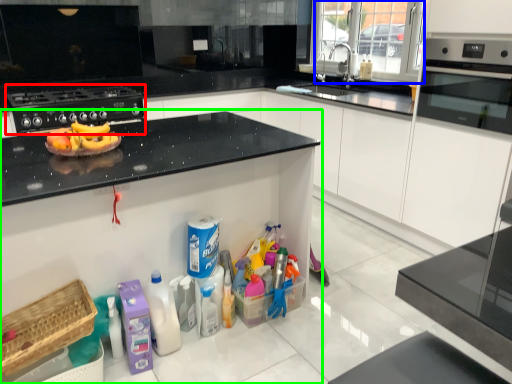
Question: Which is nearer to the kitchen appliance (highlighted by a red box)? glass door (highlighted by a blue box) or countertop (highlighted by a green box).

Choices:
 (A) glass door
 (B) countertop

Answer: (B)